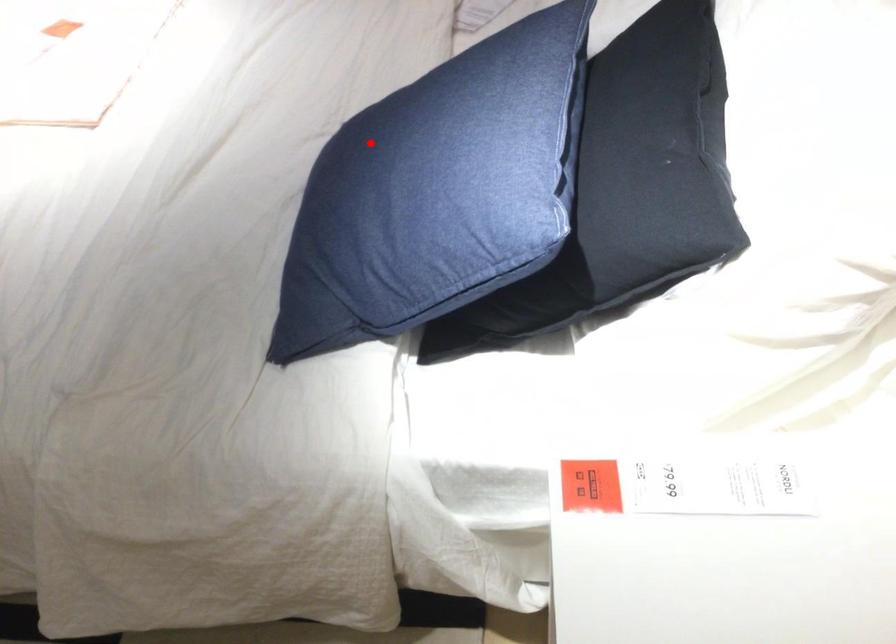
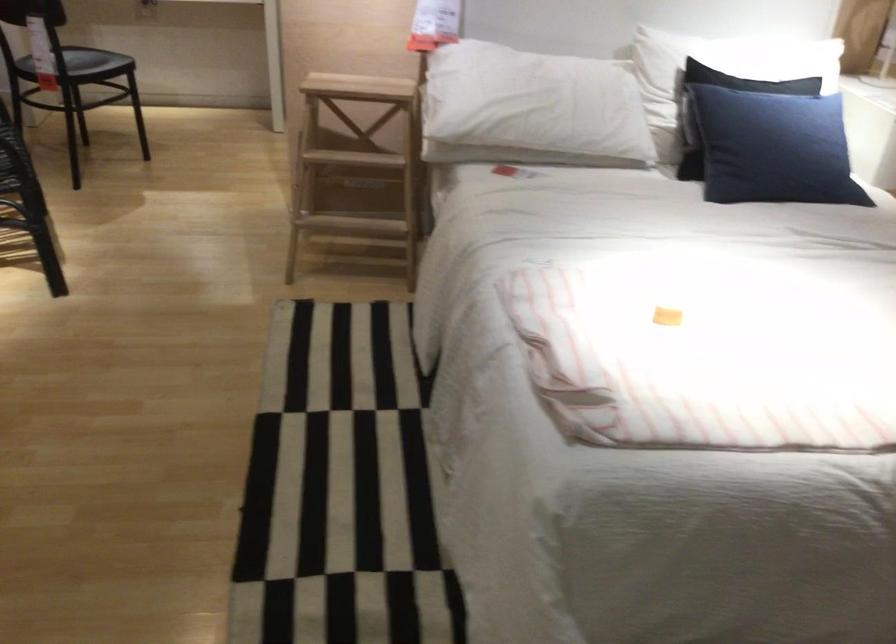
Question: A red point is marked in image1. In image2, is the corresponding 3D point closer to the camera or farther? Reply with the corresponding letter.

Choices:
 (A) The corresponding 3D point is closer.
 (B) The corresponding 3D point is farther.

Answer: (B)